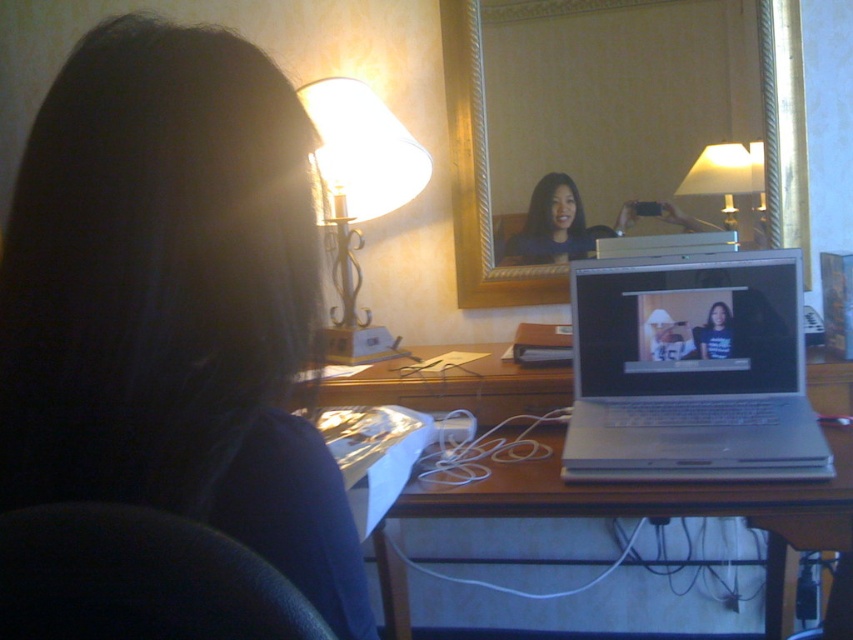
Question: Estimate the real-world distances between objects in this image. Which object is farther from the black leather chair at lower left?

Choices:
 (A) silver metallic laptop at center
 (B) gold-framed mirror at upper center

Answer: (B)

Question: Can you confirm if gold-framed mirror at upper center is bigger than wooden desk at center?

Choices:
 (A) no
 (B) yes

Answer: (A)

Question: Where is dark blue fabric at upper left located in relation to black leather chair at lower left in the image?

Choices:
 (A) right
 (B) left

Answer: (B)

Question: Estimate the real-world distances between objects in this image. Which object is farther from the wooden desk at center?

Choices:
 (A) white fabric lampshade at upper left
 (B) gold-framed mirror at upper center

Answer: (B)

Question: Can you confirm if gold-framed mirror at upper center is positioned above wooden desk at center?

Choices:
 (A) no
 (B) yes

Answer: (B)

Question: Which object is farther from the camera taking this photo?

Choices:
 (A) matte black laptop at center
 (B) white fabric lampshade at upper left

Answer: (A)